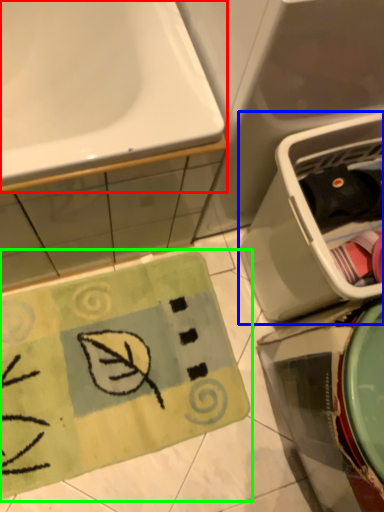
Question: Which object is positioned closest to sink (highlighted by a red box)? Select from dish washer (highlighted by a blue box) and doormat (highlighted by a green box).

Choices:
 (A) dish washer
 (B) doormat

Answer: (A)